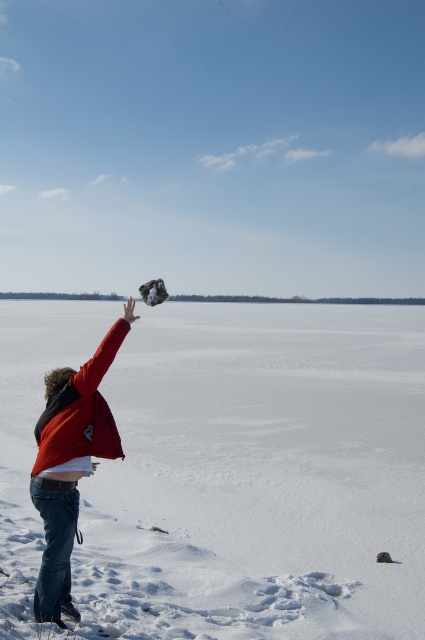
Question: Does white fluffy snow at upper center appear on the left side of red cotton jacket at center?

Choices:
 (A) yes
 (B) no

Answer: (B)

Question: Does white fluffy snow at upper center appear over red cotton jacket at center?

Choices:
 (A) yes
 (B) no

Answer: (B)

Question: Which point is farther to the camera?

Choices:
 (A) (229, 483)
 (B) (56, 598)

Answer: (A)

Question: Which of the following is the farthest from the observer?

Choices:
 (A) tap(374, 314)
 (B) tap(71, 545)

Answer: (A)

Question: Considering the relative positions of white fluffy snow at upper center and red cotton jacket at center in the image provided, where is white fluffy snow at upper center located with respect to red cotton jacket at center?

Choices:
 (A) above
 (B) below

Answer: (B)